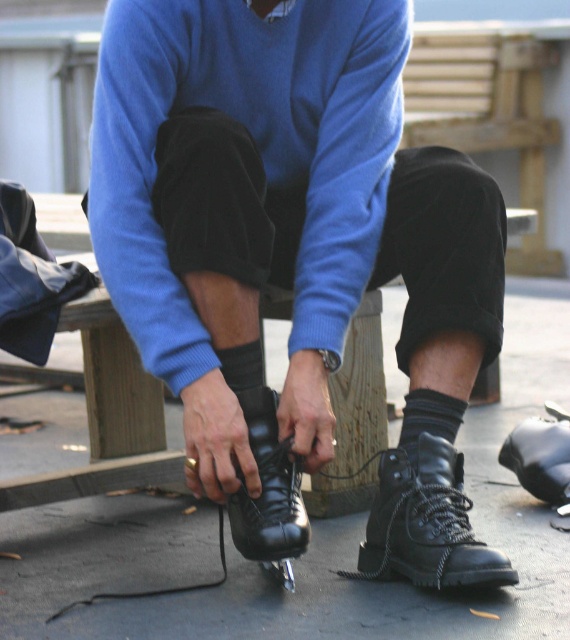
What are the coordinates of the shiny black ice skate at center?

The shiny black ice skate at center is located at coordinates (295, 253).

Consider the image. You are standing on the wooden bench and want to put on your shiny black ice skate at center and black leather boot at lower center. Which one should you put on first based on their positions?

You should put on the shiny black ice skate at center first because it is to the left of the black leather boot at lower center, so it is closer to your current position on the bench.

You are standing at the origin point in the image. A shiny black ice skate is located at point (295, 253). Which direction should you move to reach the shiny black ice skate?

The shiny black ice skate is located at point (295, 253), so you should move towards that coordinate to reach it.